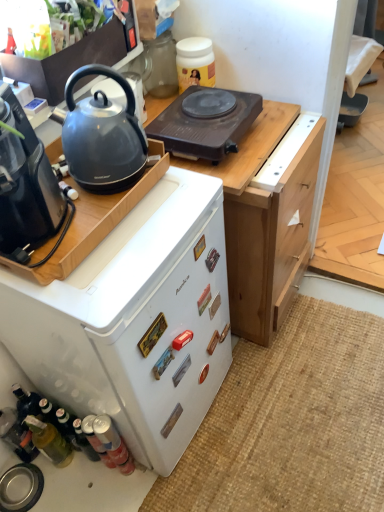
Image resolution: width=384 pixels, height=512 pixels. I want to click on vacant space in front of matte black kettle at left, so click(150, 228).